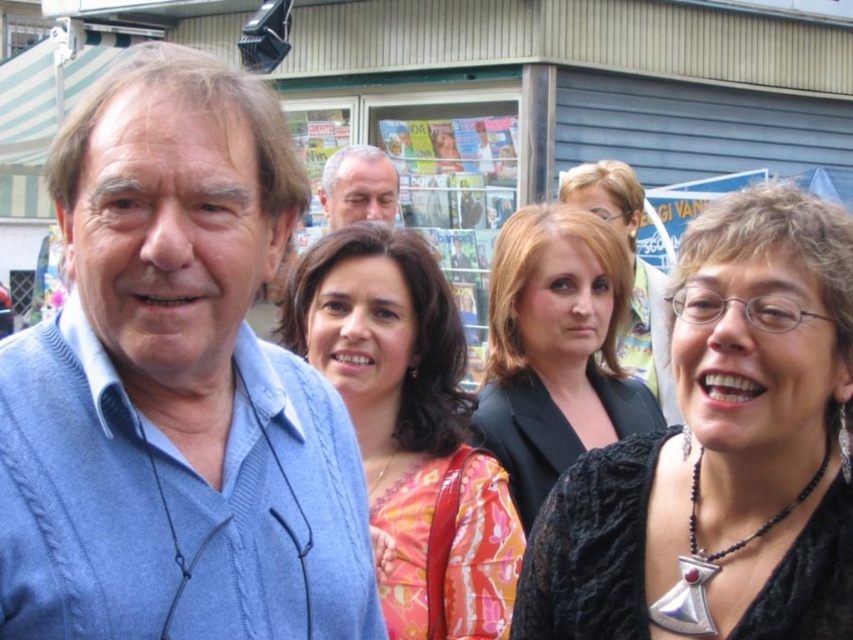
Question: Which object appears farthest from the camera in this image?

Choices:
 (A) black lace top at center
 (B) orange floral dress at center

Answer: (B)

Question: Estimate the real-world distances between objects in this image. Which object is farther from the black lace top at center?

Choices:
 (A) blue sweater at left
 (B) black fabric jacket at center
 (C) matte black blazer at center

Answer: (B)

Question: Can you confirm if black fabric jacket at center is thinner than smooth gray hair at center?

Choices:
 (A) no
 (B) yes

Answer: (B)

Question: Does blue sweater at left have a larger size compared to smooth gray hair at center?

Choices:
 (A) yes
 (B) no

Answer: (A)

Question: Can you confirm if orange floral dress at center is thinner than black fabric jacket at center?

Choices:
 (A) no
 (B) yes

Answer: (A)

Question: Among these points, which one is nearest to the camera?

Choices:
 (A) (370, 172)
 (B) (627, 353)
 (C) (630, 461)
 (D) (577, 449)

Answer: (C)